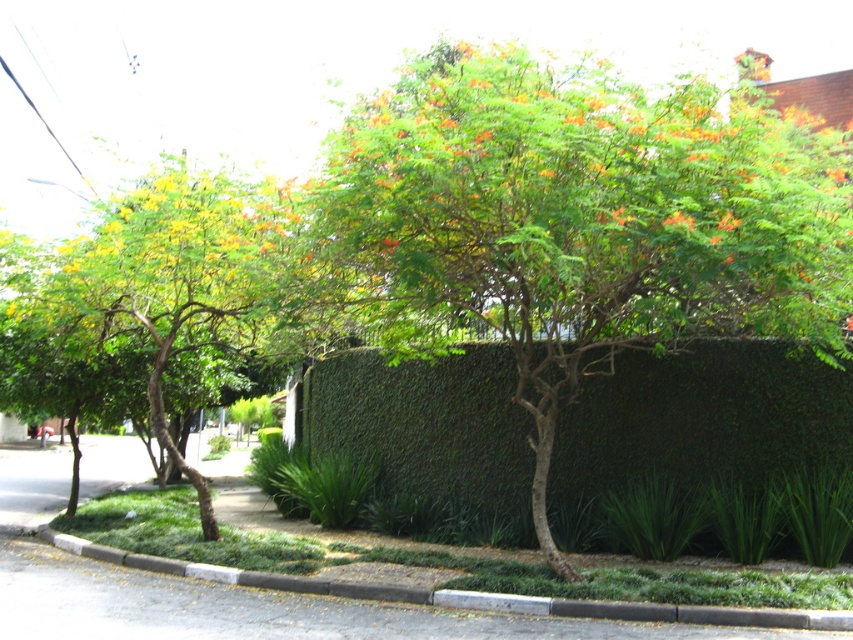
You are a gardener checking the garden layout. The green leafy hedge at center and the gray concrete curb at lower center are both in your sight. Which object is taller?

The green leafy hedge at center is much taller than the gray concrete curb at lower center.